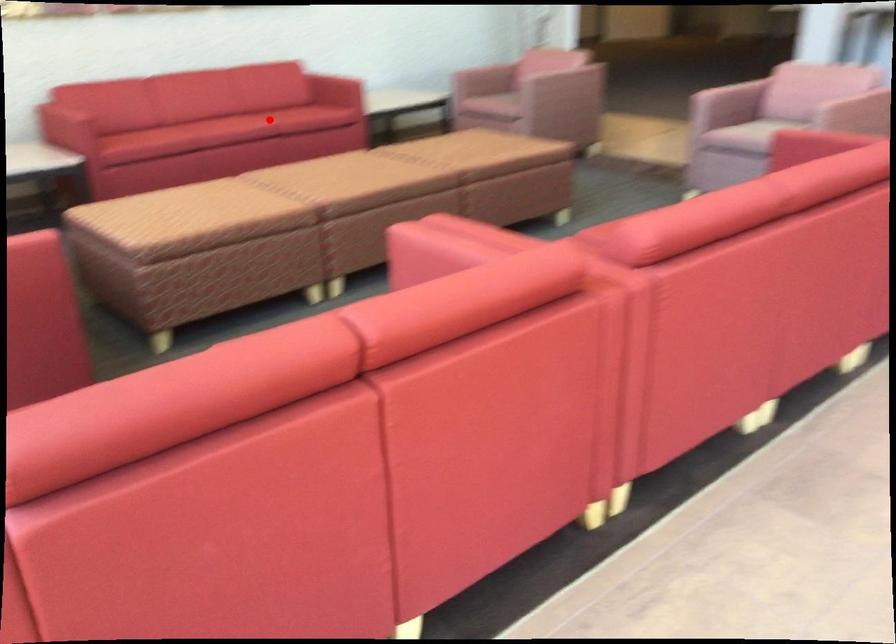
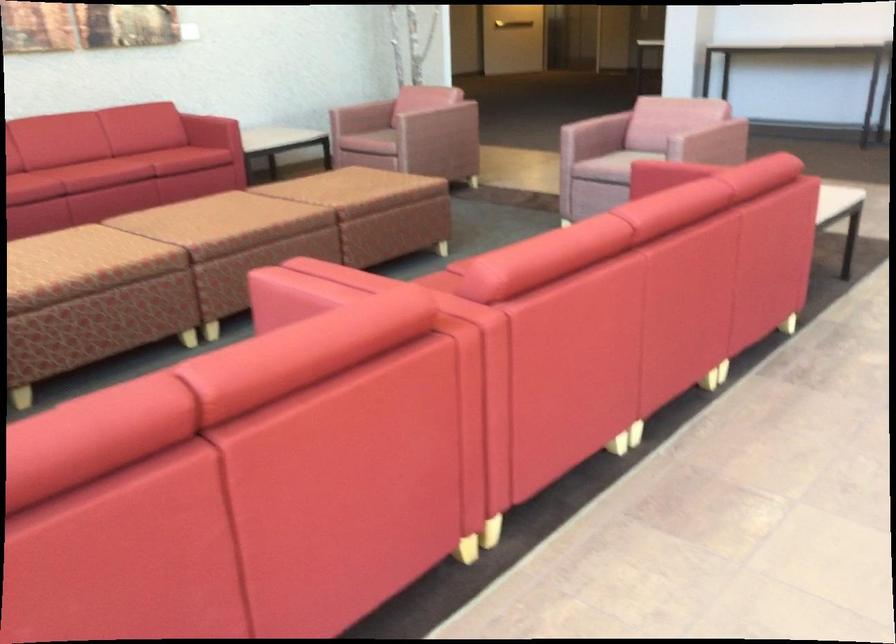
In the second image, find the point that corresponds to the highlighted location in the first image.

(142, 162)